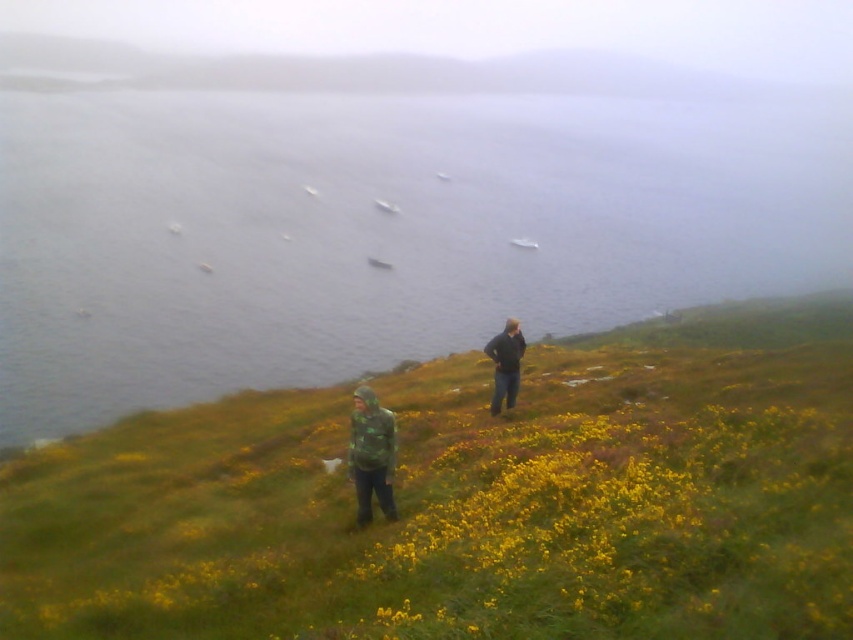
Is green grassy at lower center further to the viewer compared to camouflage jacket at lower center?

No.

The width and height of the screenshot is (853, 640). I want to click on green grassy at lower center, so click(469, 499).

Which is in front, point (520, 609) or point (373, 467)?

Point (520, 609)

I want to click on green grassy at lower center, so click(469, 499).

Is gray water at center to the right of green grassy at lower center from the viewer's perspective?

Correct, you'll find gray water at center to the right of green grassy at lower center.

Which is above, gray water at center or green grassy at lower center?

gray water at center

Describe the element at coordinates (376, 212) in the screenshot. I see `gray water at center` at that location.

Locate an element on the screen. gray water at center is located at coordinates pos(376,212).

Can you confirm if yellow matte flowers at center is smaller than dark blue jeans at center?

Yes, yellow matte flowers at center is smaller than dark blue jeans at center.

Between yellow matte flowers at center and dark blue jeans at center, which one has less height?

Standing shorter between the two is yellow matte flowers at center.

In order to click on yellow matte flowers at center in this screenshot , I will do `click(630, 536)`.